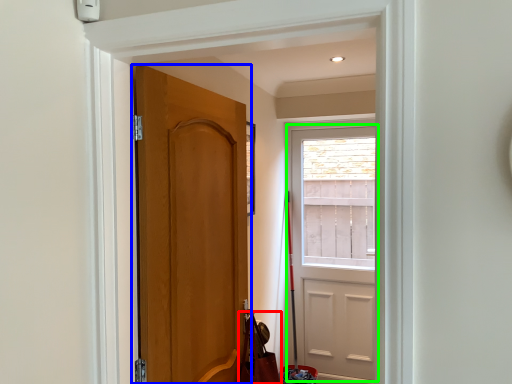
Question: Which is nearer to the shoulder bag (highlighted by a red box)? door (highlighted by a blue box) or door (highlighted by a green box).

Choices:
 (A) door
 (B) door

Answer: (A)